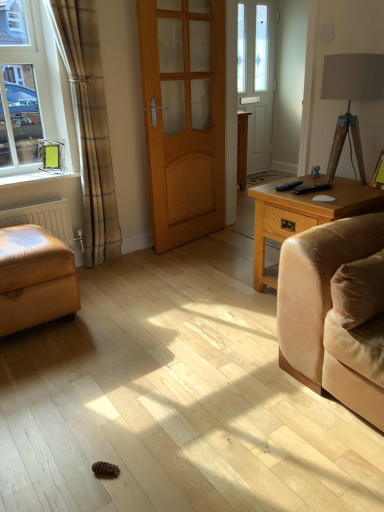
Locate an element on the screen. Image resolution: width=384 pixels, height=512 pixels. free space in front of leather armchair at left is located at coordinates (49, 365).